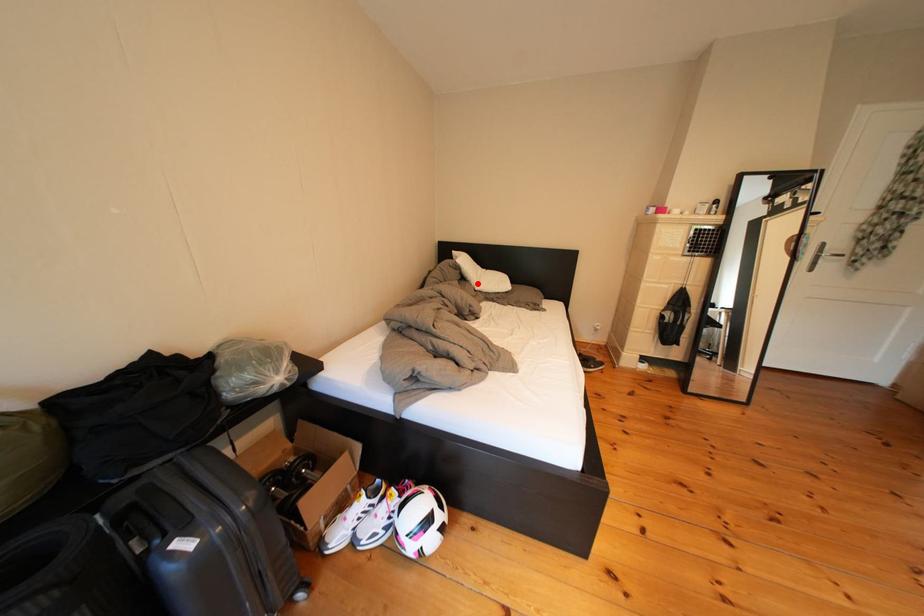
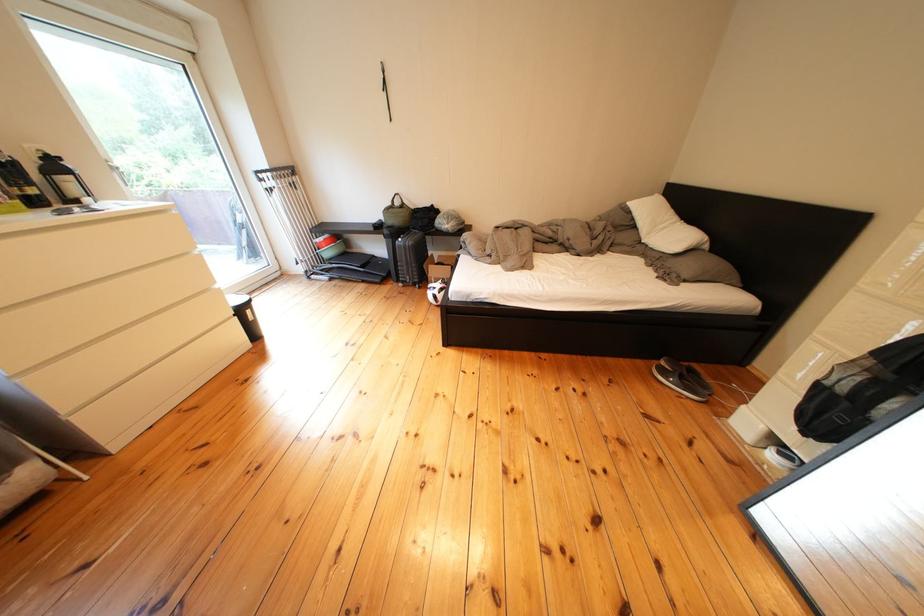
Where in the second image is the point corresponding to the highlighted location from the first image?

(649, 230)